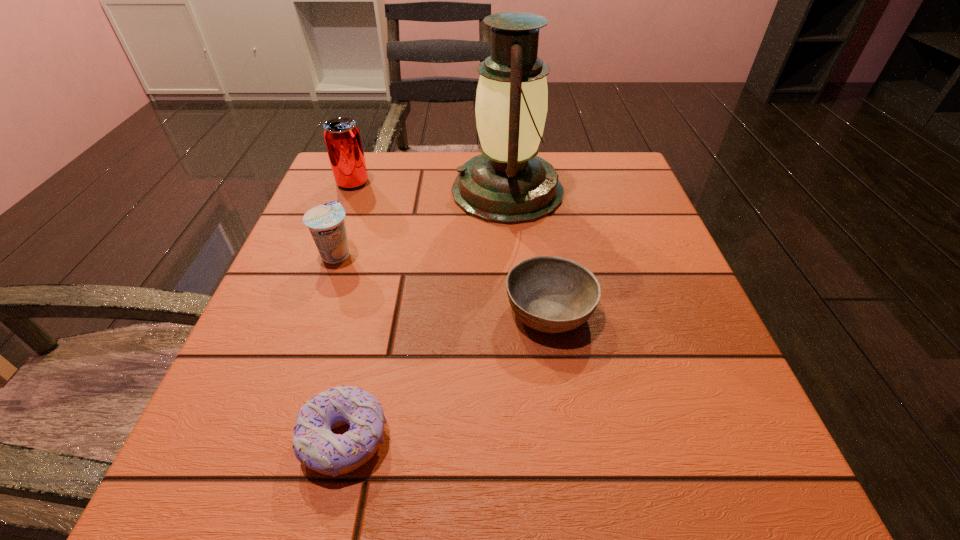
Choose which object is the fourth nearest neighbor to the third tallest object. Please provide its 2D coordinates. Your answer should be formatted as a tuple, i.e. [(x, y)], where the tuple contains the x and y coordinates of a point satisfying the conditions above.

[(551, 294)]

In order to click on vacant region that satisfies the following two spatial constraints: 1. on the front side of the soda can; 2. on the right side of the shortest object in this screenshot , I will do `click(254, 438)`.